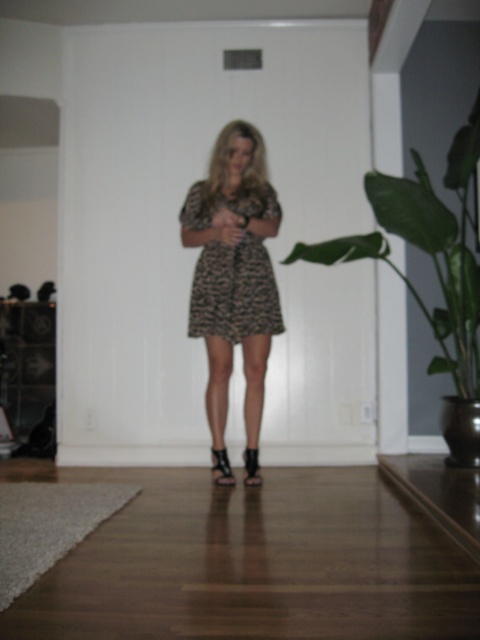
You are a fashion designer trying to decide which leopard print dress to feature in your collection. You have two options in the image, the leopard print dress at center and the leopard print fabric dress at center. Which one is bigger?

The leopard print dress at center is larger in size than the leopard print fabric dress at center.

You are an interior designer assessing the layout of this room. The leopard print dress at center is positioned at coordinates 0.441 on the x and 0.487 on the y axis. If the room is 5 meters wide and 4 meters tall, what are the dress actual dimensions in meters?

The leopard print dress at center is located at coordinates [233,282]. To find its actual dimensions, multiply the coordinates by the room dimensions. The x dimension would be 0.441 multiplied by 5 meters, which equals approximately 2.205 meters. The y dimension would be 0.487 multiplied by 4 meters, resulting in roughly 1.948 meters. However, since the dress is a 2D representation, these values represent its position rather than physical size.

You are a fashion designer observing the leopard print dress at center and the leopard print fabric dress at center in the image. Which one is taller?

A: The leopard print dress at center is taller than the leopard print fabric dress at center.